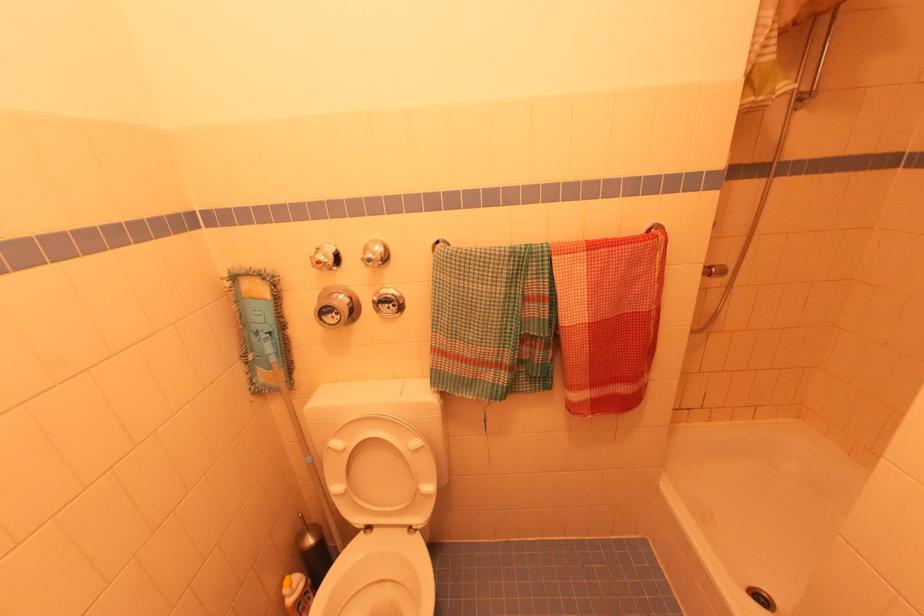
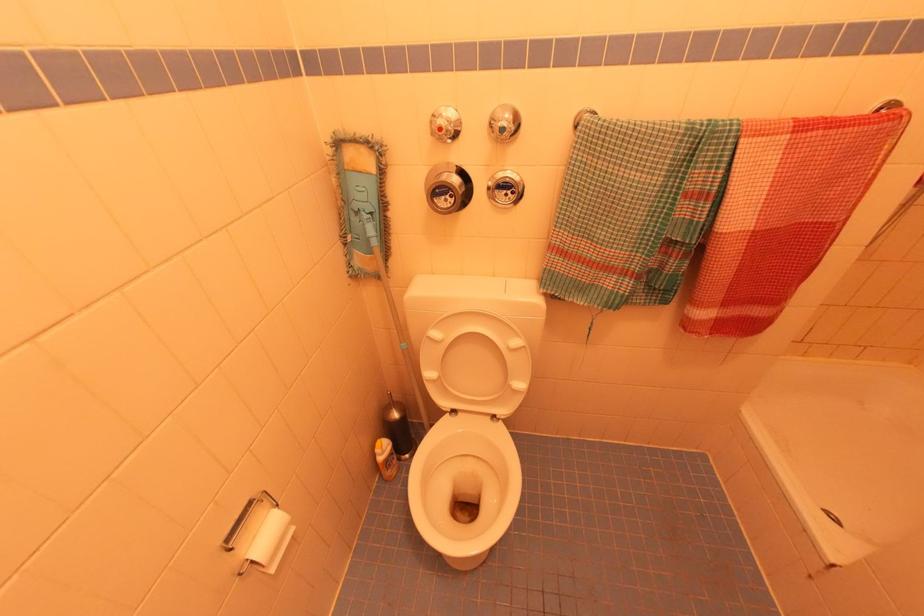
Find the pixel in the second image that matches (395,306) in the first image.

(515, 193)